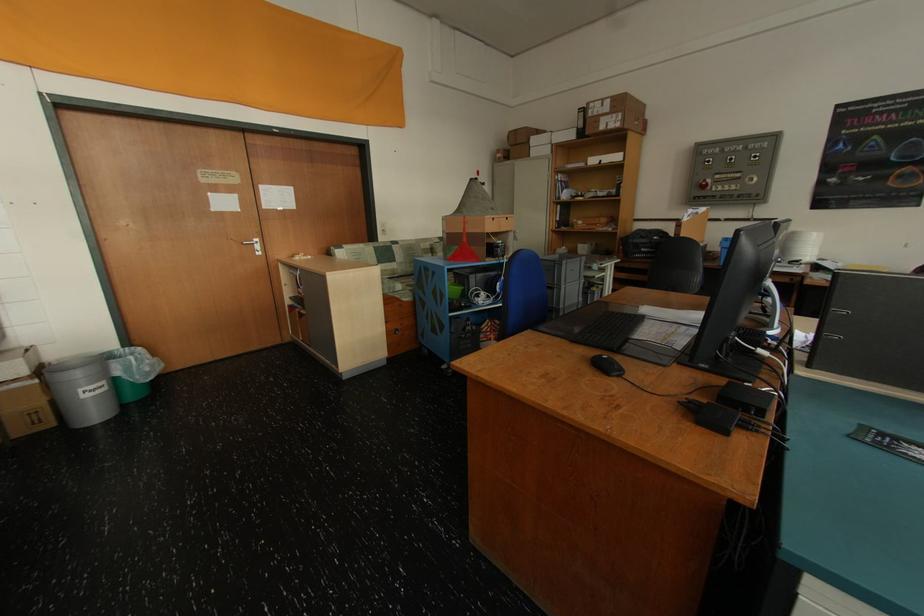
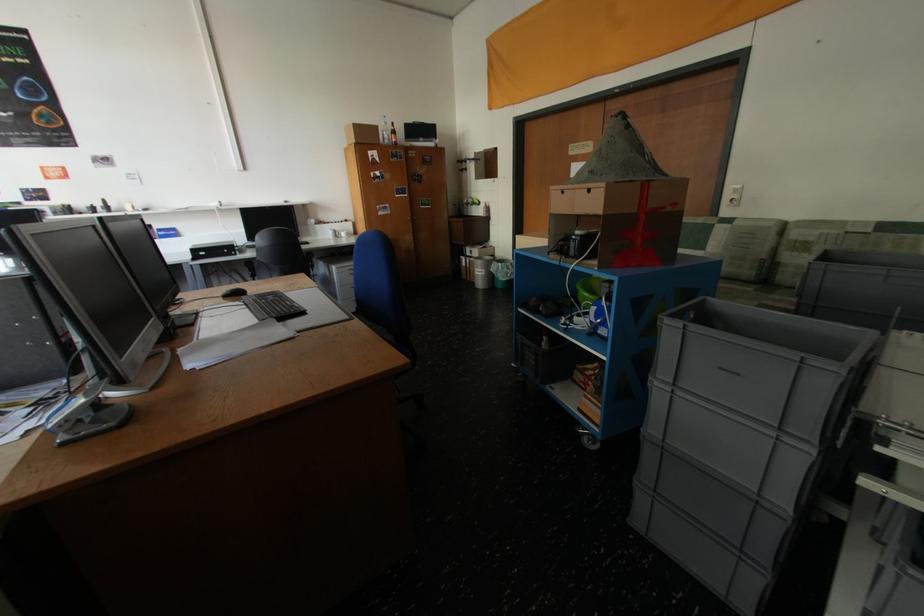
Where in the second image is the point corresponding to (516,220) from the first image?

(598, 192)